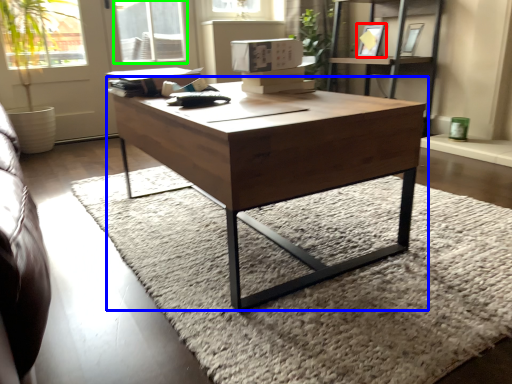
Question: Based on their relative distances, which object is farther from picture frame (highlighted by a red box)? Choose from coffee table (highlighted by a blue box) and window (highlighted by a green box).

Choices:
 (A) coffee table
 (B) window

Answer: (A)